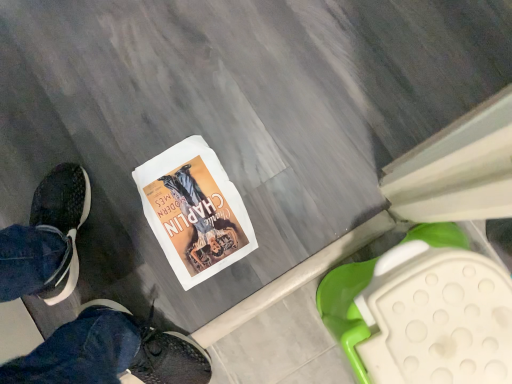
Locate an element on the screen. The width and height of the screenshot is (512, 384). white paper comic book at center is located at coordinates (194, 211).

This screenshot has width=512, height=384. Describe the element at coordinates (194, 211) in the screenshot. I see `white paper comic book at center` at that location.

Identify the location of white paper comic book at center. (194, 211).